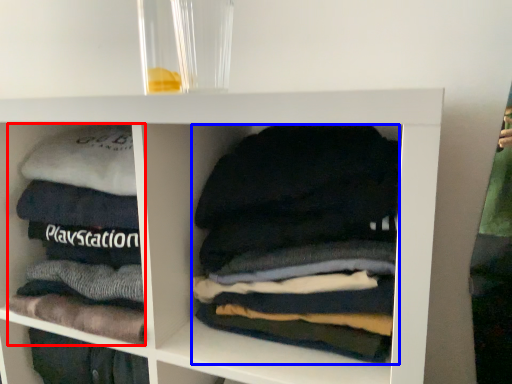
Question: Which object is closer to the camera taking this photo, material (highlighted by a red box) or laundry (highlighted by a blue box)?

Choices:
 (A) material
 (B) laundry

Answer: (B)